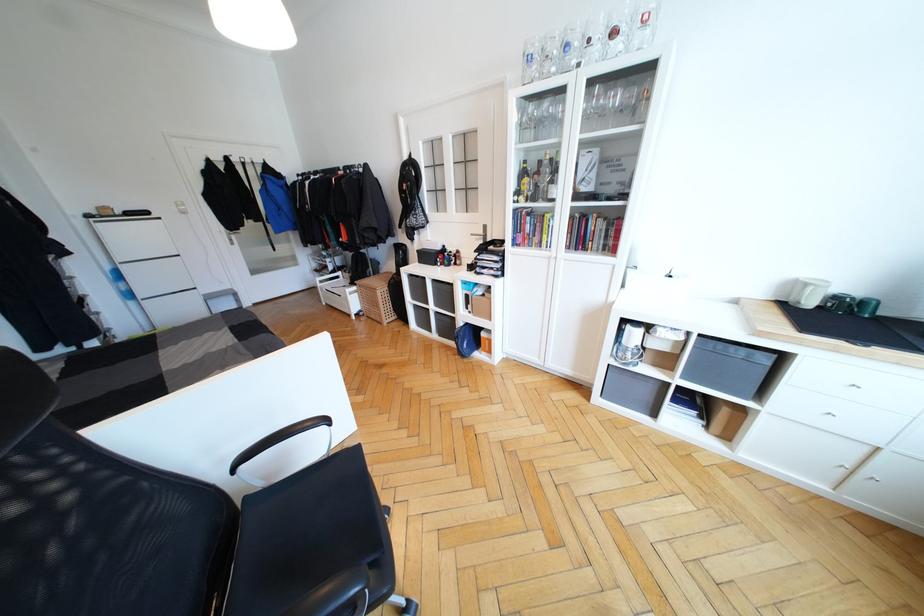
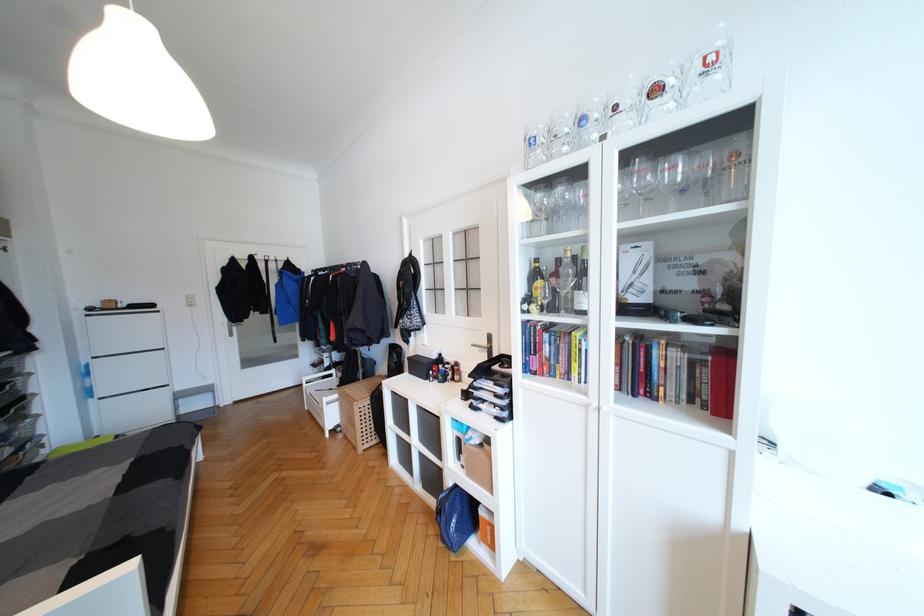
In the second image, find the point that corresponds to point (629, 89) in the first image.

(694, 156)